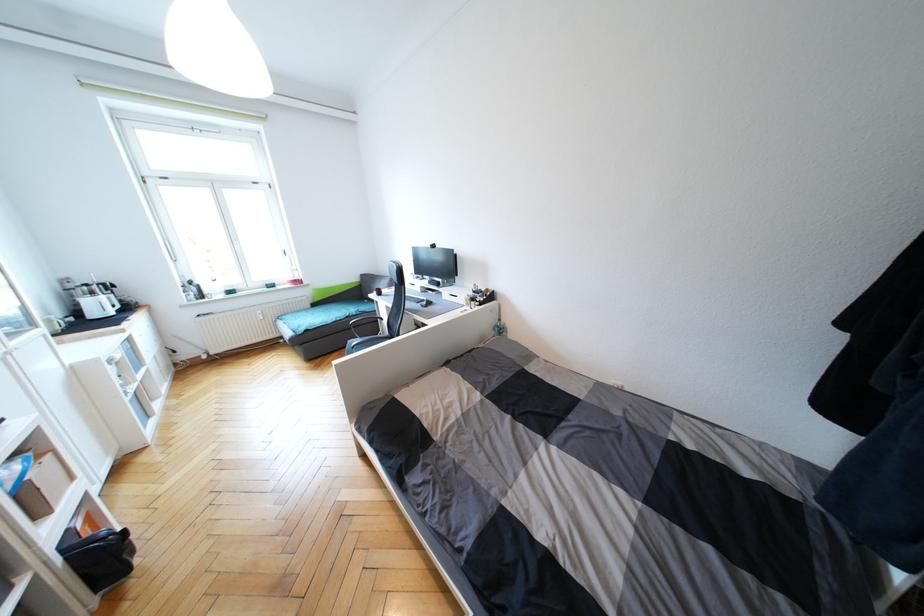
I want to click on white mug, so click(94, 306).